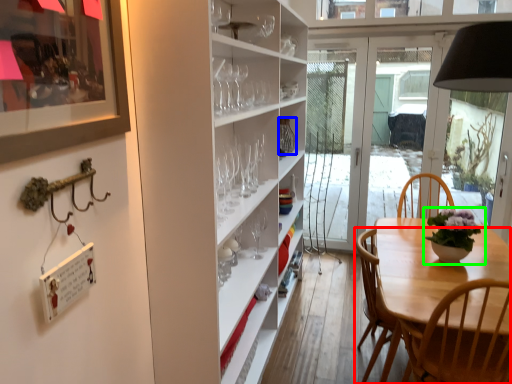
Question: Which object is positioned closest to chair (highlighted by a red box)? Select from glass vase (highlighted by a blue box) and houseplant (highlighted by a green box).

Choices:
 (A) glass vase
 (B) houseplant

Answer: (B)